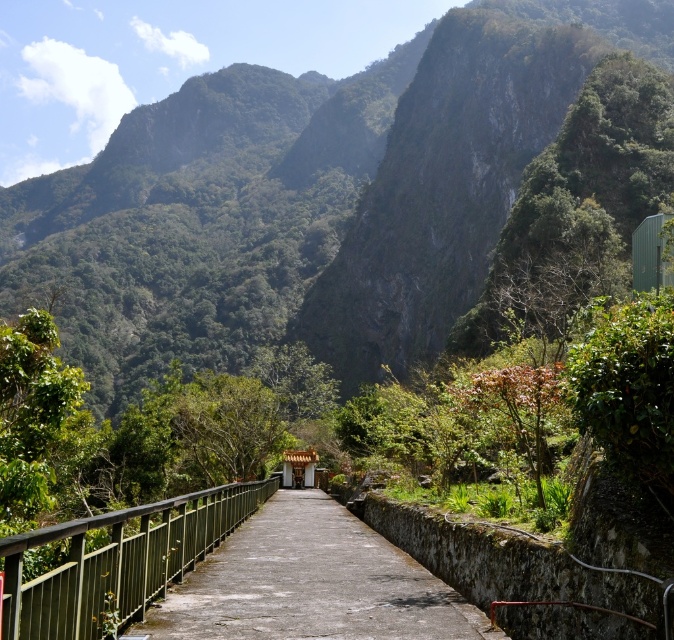
Question: Which object is the closest to the green leafy mountain at upper center?

Choices:
 (A) concrete at center
 (B) green metal railing at center

Answer: (A)

Question: Which of the following is the closest to the observer?

Choices:
 (A) green leafy mountain at upper center
 (B) concrete at center

Answer: (B)

Question: Does green leafy mountain at upper center appear under concrete at center?

Choices:
 (A) yes
 (B) no

Answer: (B)

Question: Based on their relative distances, which object is farther from the concrete at center?

Choices:
 (A) green leafy mountain at upper center
 (B) green metal railing at center

Answer: (A)

Question: Is green leafy mountain at upper center positioned in front of green metal railing at center?

Choices:
 (A) no
 (B) yes

Answer: (A)

Question: Can you confirm if green leafy mountain at upper center is bigger than green metal railing at center?

Choices:
 (A) no
 (B) yes

Answer: (B)